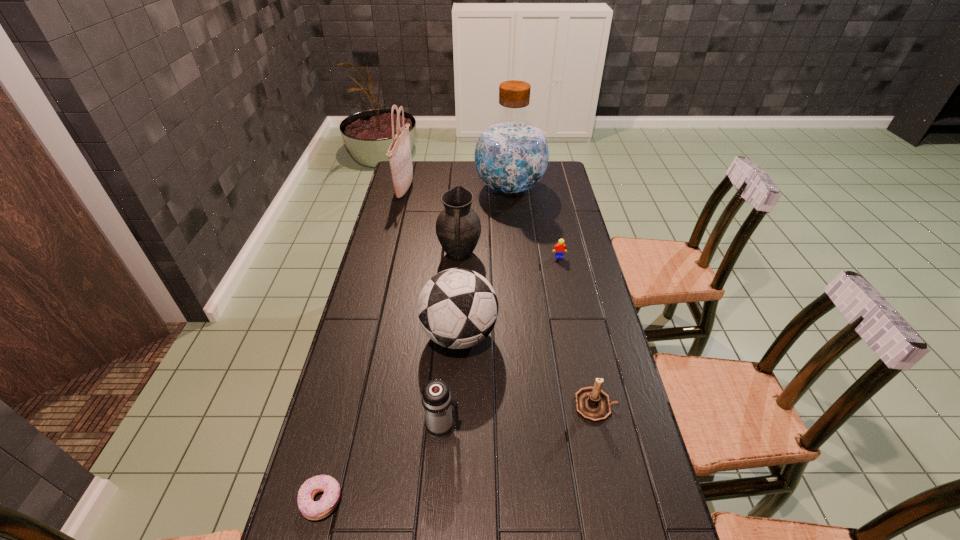
Where is `vacant space at the far right corner of the desktop`? Image resolution: width=960 pixels, height=540 pixels. vacant space at the far right corner of the desktop is located at coordinates tap(566, 180).

The image size is (960, 540). Identify the location of free point between the fifth tallest object and the nearest object. (382, 464).

Where is `free space between the fifth farthest object and the shopping bag`? This screenshot has height=540, width=960. free space between the fifth farthest object and the shopping bag is located at coordinates (432, 262).

Identify the location of unoccupied position between the water jug and the pitcher. The width and height of the screenshot is (960, 540). tap(485, 221).

Image resolution: width=960 pixels, height=540 pixels. Identify the location of empty space that is in between the tallest object and the doughnut. (416, 345).

I want to click on unoccupied area between the fifth tallest object and the fourth nearest object, so click(451, 381).

Where is `empty location between the soccer ball and the second shortest object`? Image resolution: width=960 pixels, height=540 pixels. empty location between the soccer ball and the second shortest object is located at coordinates (509, 296).

This screenshot has width=960, height=540. Find the location of `free space between the water jug and the fifth farthest object`. free space between the water jug and the fifth farthest object is located at coordinates (485, 261).

Identify the location of unoccupied area between the water jug and the soccer ball. (485, 261).

What are the coordinates of `free space that is in between the nearest object and the second tallest object` in the screenshot? It's located at (363, 345).